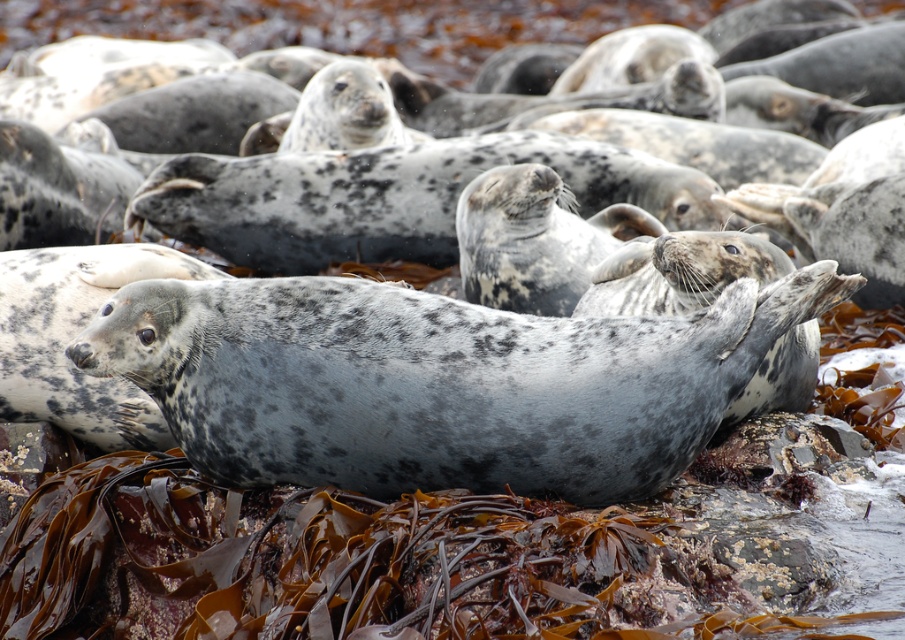
You are standing at the edge of the rocky shore and want to approach the seal at the point marked as [437,381]. Is this seal the one with the mottled gray coat lying on its side in the foreground?

Yes, the point [437,381] corresponds to the spotted fur seal at center, which is the seal with the mottled gray coat lying on its side in the foreground.

You are a wildlife photographer observing the seals on the rocky shore. You have two seals in your viewfinder, the spotted fur seal at center and the speckled fur seal at center. Which seal is located to the right side of the other?

The spotted fur seal at center is positioned on the right side of the speckled fur seal at center.

You are a wildlife photographer standing at the camera position. You want to take a photo of the spotted fur seal at center without getting too close to disturb it. The recommended safe distance is 10 feet. Is your current position within the safe distance?

The spotted fur seal at center and camera are 9.68 feet apart from each other. Since 9.68 feet is less than the recommended 10 feet safe distance, you are currently too close to the seal and should move back to maintain a safe distance.